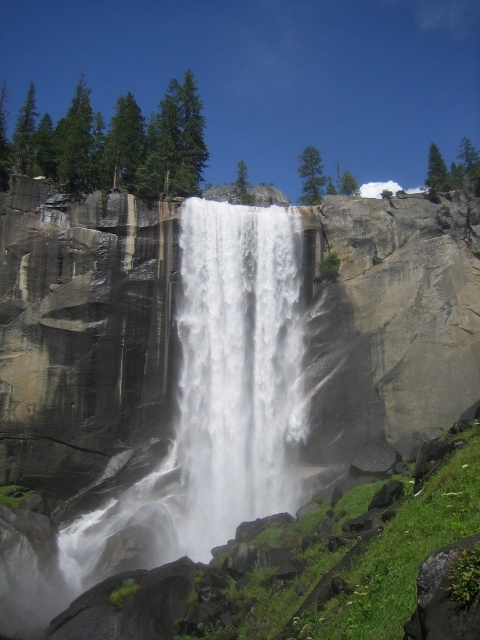
Question: Is gray/rough rock face at center below white frothy water at center?

Choices:
 (A) yes
 (B) no

Answer: (B)

Question: Which point is farther from the camera taking this photo?

Choices:
 (A) (248, 364)
 (B) (265, 282)

Answer: (B)

Question: Is gray/rough rock face at center positioned behind white frothy water at center?

Choices:
 (A) no
 (B) yes

Answer: (A)

Question: Does gray/rough rock face at center lie in front of white frothy water at center?

Choices:
 (A) yes
 (B) no

Answer: (A)

Question: Which point is closer to the camera taking this photo?

Choices:
 (A) pos(312,218)
 (B) pos(208,544)

Answer: (B)